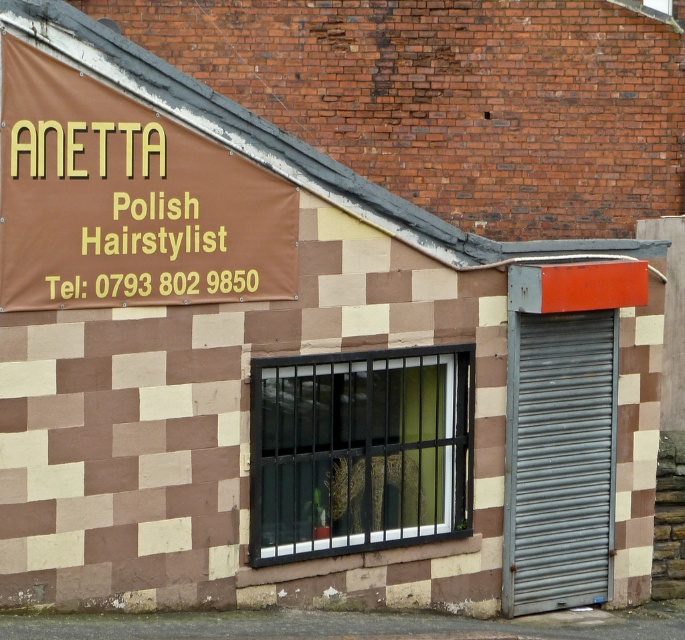
Does point (282, 428) lie behind point (590, 349)?

That is False.

At what (x,y) coordinates should I click in order to perform the action: click on black metal window at center. Please return your answer as a coordinate pair (x, y). Looking at the image, I should click on (360, 451).

Does brown vinyl banner at upper left have a smaller size compared to black metal window at center?

No.

Which is above, brown vinyl banner at upper left or black metal window at center?

brown vinyl banner at upper left

Image resolution: width=685 pixels, height=640 pixels. I want to click on brown vinyl banner at upper left, so click(127, 200).

At what (x,y) coordinates should I click in order to perform the action: click on brown vinyl banner at upper left. Please return your answer as a coordinate pair (x, y). Image resolution: width=685 pixels, height=640 pixels. Looking at the image, I should click on (127, 200).

Between brown vinyl banner at upper left and gray metallic shutter at right, which one is positioned higher?

brown vinyl banner at upper left is above.

This screenshot has height=640, width=685. Describe the element at coordinates (127, 200) in the screenshot. I see `brown vinyl banner at upper left` at that location.

This screenshot has height=640, width=685. In order to click on brown vinyl banner at upper left in this screenshot , I will do `click(127, 200)`.